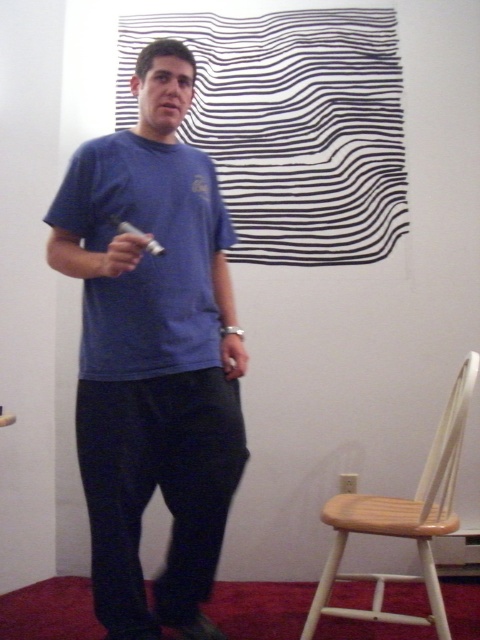
Question: Does blue cotton t-shirt at center appear over wooden at right?

Choices:
 (A) yes
 (B) no

Answer: (A)

Question: Which is farther from the blue cotton shirt at center?

Choices:
 (A) matte white remote at center
 (B) blue cotton t-shirt at center

Answer: (A)

Question: Is blue cotton t-shirt at center to the left of wooden at right from the viewer's perspective?

Choices:
 (A) no
 (B) yes

Answer: (B)

Question: Is blue cotton t-shirt at center to the left of wooden at right from the viewer's perspective?

Choices:
 (A) yes
 (B) no

Answer: (A)

Question: Which object is positioned closest to the blue cotton shirt at center?

Choices:
 (A) matte white remote at center
 (B) wooden at right

Answer: (A)

Question: Which of the following is the farthest from the observer?

Choices:
 (A) (108, 368)
 (B) (148, 308)
 (C) (132, 268)

Answer: (B)